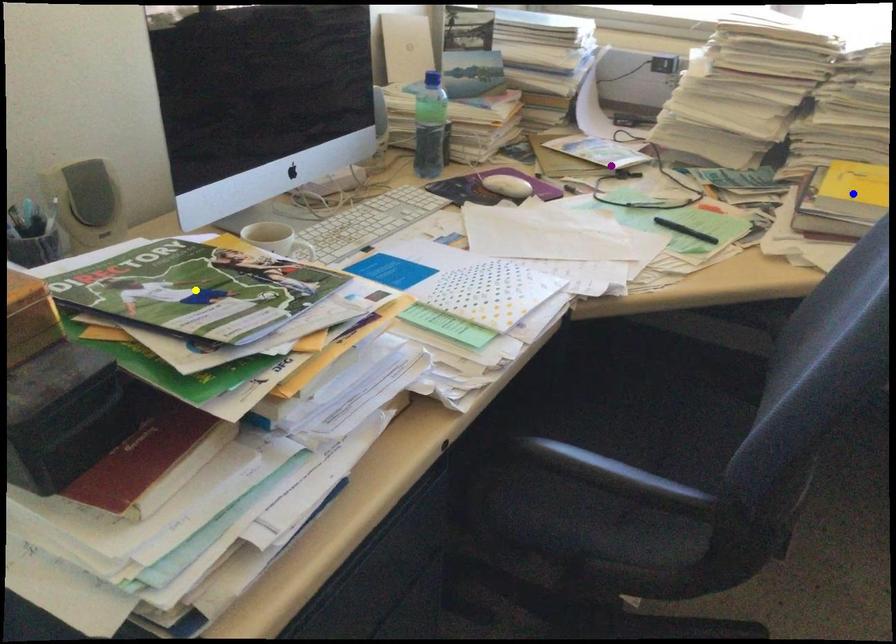
Order these from farthest to nearest:
A) purple point
B) yellow point
C) blue point

purple point → blue point → yellow point